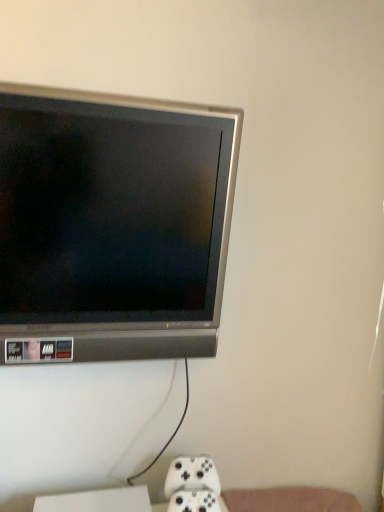
What do you see at coordinates (114, 222) in the screenshot? I see `satin silver television at upper left` at bounding box center [114, 222].

Locate an element on the screen. satin silver television at upper left is located at coordinates 114,222.

This screenshot has width=384, height=512. I want to click on white matte game controller at lower center, so (192, 485).

Image resolution: width=384 pixels, height=512 pixels. Describe the element at coordinates (192, 485) in the screenshot. I see `white matte game controller at lower center` at that location.

Measure the distance between point (209, 498) and camera.

The depth of point (209, 498) is 1.14 meters.

Image resolution: width=384 pixels, height=512 pixels. In order to click on satin silver television at upper left in this screenshot , I will do `click(114, 222)`.

Considering the positions of objects satin silver television at upper left and white matte game controller at lower center in the image provided, who is more to the right, satin silver television at upper left or white matte game controller at lower center?

white matte game controller at lower center is more to the right.

Does satin silver television at upper left come in front of white matte game controller at lower center?

That is True.

Does point (70, 297) appear closer or farther from the camera than point (170, 471)?

Point (70, 297) is positioned closer to the camera compared to point (170, 471).

From the image's perspective, is satin silver television at upper left under white matte game controller at lower center?

No.

From a real-world perspective, relative to white matte game controller at lower center, is satin silver television at upper left vertically above or below?

satin silver television at upper left is above white matte game controller at lower center.

Considering the sizes of objects satin silver television at upper left and white matte game controller at lower center in the image provided, who is thinner, satin silver television at upper left or white matte game controller at lower center?

Thinner between the two is white matte game controller at lower center.

In the scene shown: Considering the relative sizes of satin silver television at upper left and white matte game controller at lower center in the image provided, is satin silver television at upper left shorter than white matte game controller at lower center?

Incorrect, the height of satin silver television at upper left does not fall short of that of white matte game controller at lower center.

Looking at this image, is satin silver television at upper left smaller than white matte game controller at lower center?

No, satin silver television at upper left is not smaller than white matte game controller at lower center.

Is satin silver television at upper left spatially inside white matte game controller at lower center, or outside of it?

Result: satin silver television at upper left is located beyond the bounds of white matte game controller at lower center.

Is satin silver television at upper left next to white matte game controller at lower center?

satin silver television at upper left and white matte game controller at lower center are not in contact.

From the picture: Does satin silver television at upper left turn towards white matte game controller at lower center?

No.

What's the angular difference between satin silver television at upper left and white matte game controller at lower center's facing directions?

There is a 7.7-degree angle between the facing directions of satin silver television at upper left and white matte game controller at lower center.

I want to click on game controller lying behind the satin silver television at upper left, so click(192, 485).

Between white matte game controller at lower center and satin silver television at upper left, which one appears on the right side from the viewer's perspective?

white matte game controller at lower center.

Is white matte game controller at lower center further to the viewer compared to satin silver television at upper left?

Yes, white matte game controller at lower center is further from the camera.

Does point (173, 479) come behind point (19, 229)?

Yes, point (173, 479) is behind point (19, 229).

From the image's perspective, is white matte game controller at lower center above satin silver television at upper left?

Incorrect, from the image's perspective, white matte game controller at lower center is lower than satin silver television at upper left.

From a real-world perspective, relative to satin silver television at upper left, is white matte game controller at lower center vertically above or below?

In terms of real-world spatial position, white matte game controller at lower center is below satin silver television at upper left.

Is white matte game controller at lower center wider than satin silver television at upper left?

In fact, white matte game controller at lower center might be narrower than satin silver television at upper left.

Considering the sizes of white matte game controller at lower center and satin silver television at upper left in the image, is white matte game controller at lower center taller or shorter than satin silver television at upper left?

white matte game controller at lower center is shorter than satin silver television at upper left.

Is white matte game controller at lower center bigger than satin silver television at upper left?

No, white matte game controller at lower center is not bigger than satin silver television at upper left.

Is white matte game controller at lower center outside of satin silver television at upper left?

white matte game controller at lower center lies outside satin silver television at upper left's area.

Is white matte game controller at lower center not close to satin silver television at upper left?

No, white matte game controller at lower center is in close proximity to satin silver television at upper left.

Is satin silver television at upper left at the back of white matte game controller at lower center?

white matte game controller at lower center is not turned away from satin silver television at upper left.

Locate an element on the screen. television that is on the left side of white matte game controller at lower center is located at coordinates (114, 222).

Locate an element on the screen. The image size is (384, 512). television above the white matte game controller at lower center (from a real-world perspective) is located at coordinates (114, 222).

Locate an element on the screen. This screenshot has width=384, height=512. television to the left of white matte game controller at lower center is located at coordinates (114, 222).